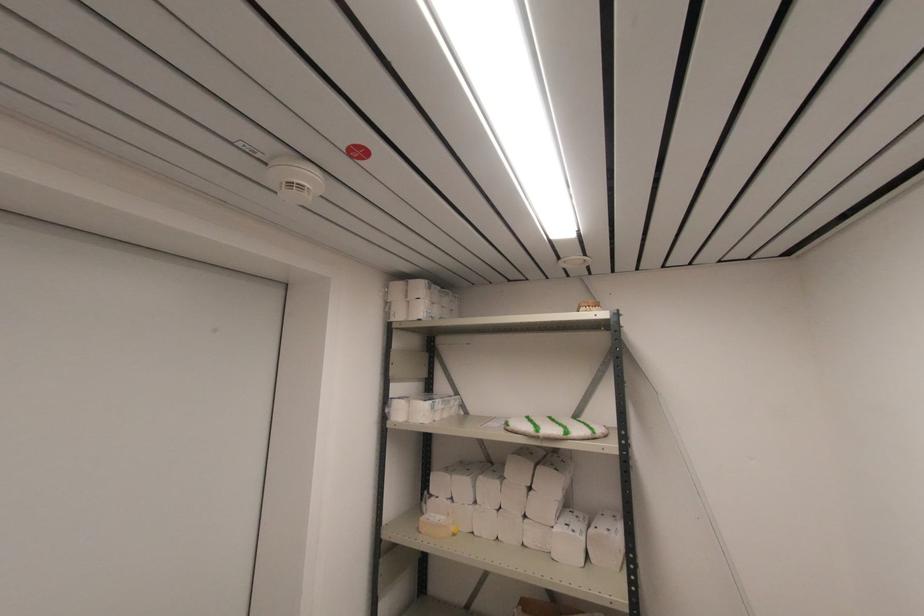
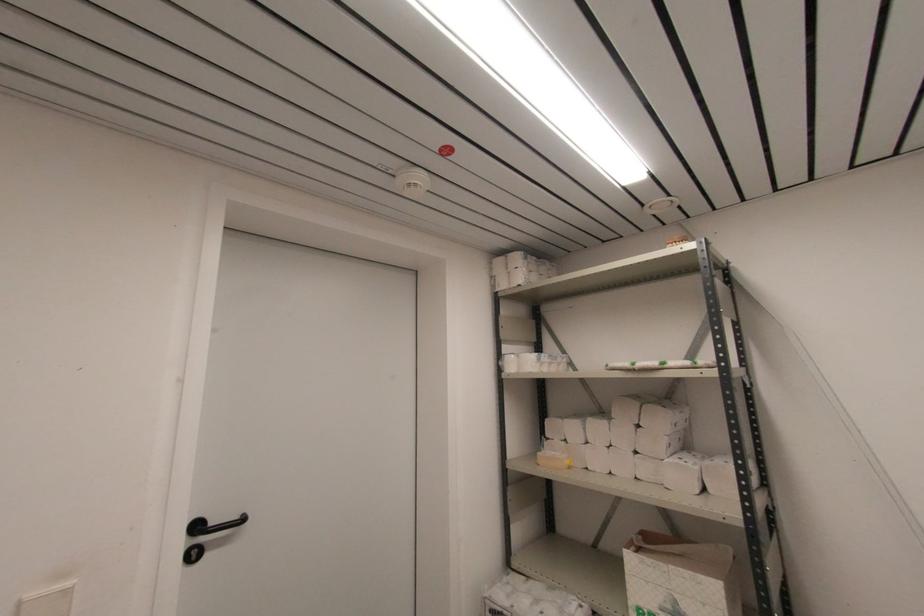
Locate, in the second image, the point that corresponds to [392,397] in the first image.

(504, 354)